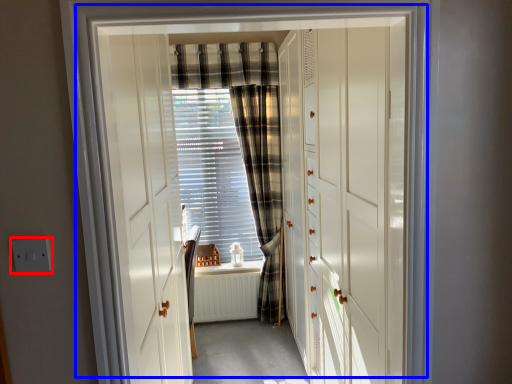
Question: Which object appears farthest to the camera in this image, electric outlet (highlighted by a red box) or door (highlighted by a blue box)?

Choices:
 (A) electric outlet
 (B) door

Answer: (A)